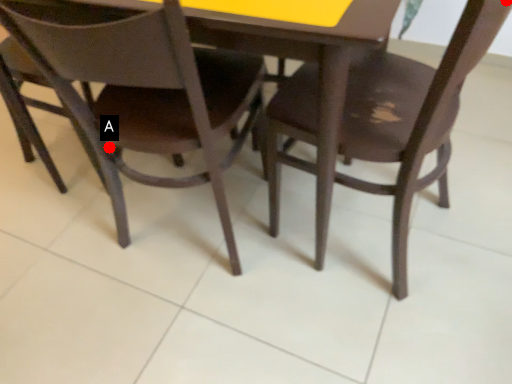
Question: Two points are circled on the image, labeled by A and B beside each circle. Which point is closer to the camera?

Choices:
 (A) A is closer
 (B) B is closer

Answer: (B)